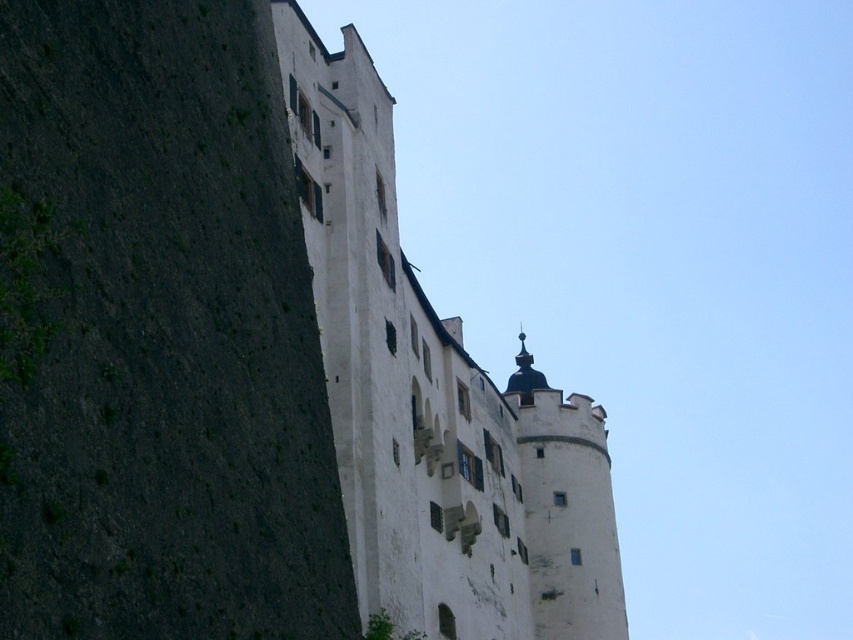
Question: In this image, where is dark gray stone wall at left located relative to white stone castle at center?

Choices:
 (A) below
 (B) above

Answer: (B)

Question: Which point is closer to the camera?

Choices:
 (A) white stone castle at center
 (B) white stone tower at upper right
 (C) dark gray stone wall at left

Answer: (C)

Question: Observing the image, what is the correct spatial positioning of dark gray stone wall at left in reference to white stone castle at center?

Choices:
 (A) right
 (B) left

Answer: (B)

Question: Which object appears closest to the camera in this image?

Choices:
 (A) dark gray stone wall at left
 (B) white stone tower at upper right

Answer: (A)

Question: Is dark gray stone wall at left to the left of white stone tower at upper right from the viewer's perspective?

Choices:
 (A) no
 (B) yes

Answer: (B)

Question: Which object is the closest to the white stone castle at center?

Choices:
 (A) dark gray stone wall at left
 (B) white stone tower at upper right

Answer: (B)